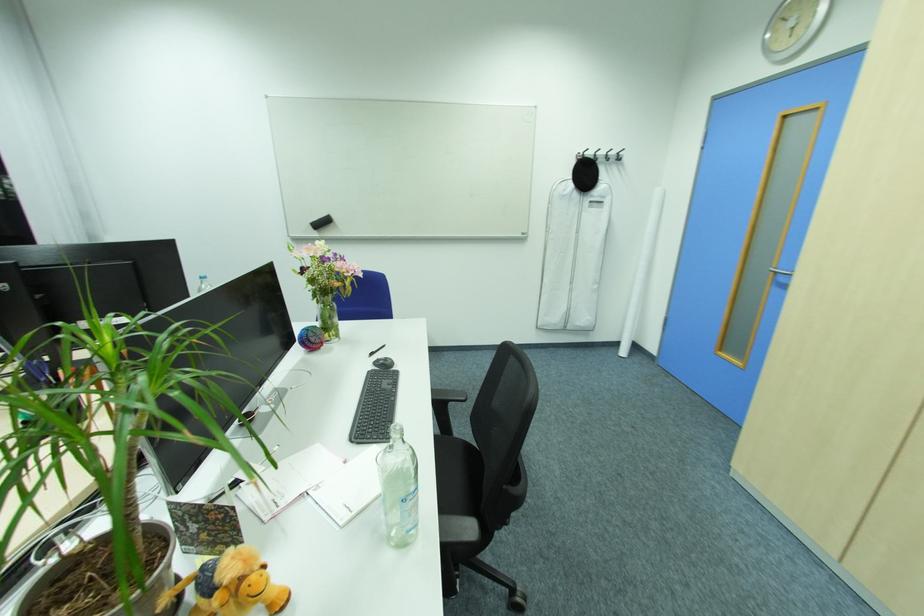
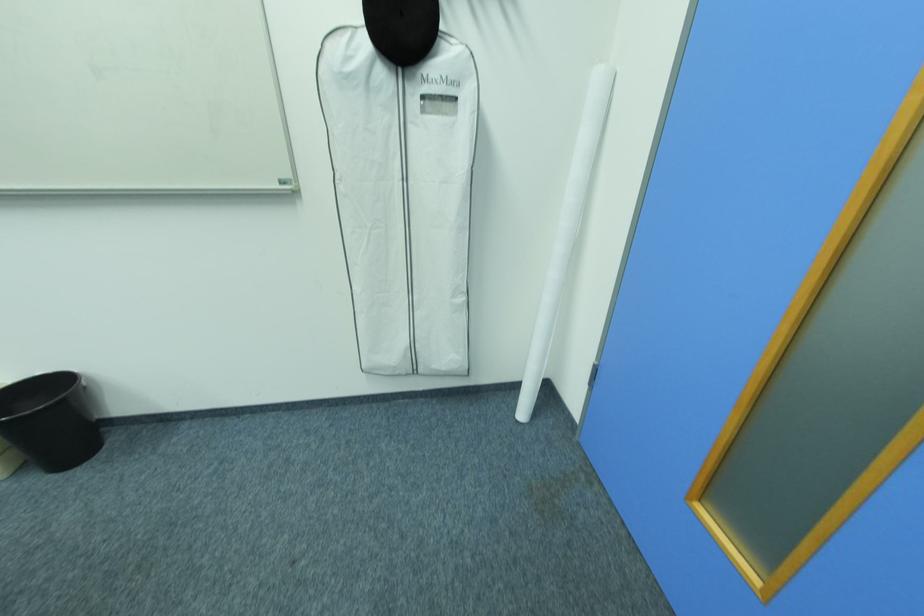
Locate, in the second image, the point that corresponds to point (597, 201) in the first image.

(428, 98)